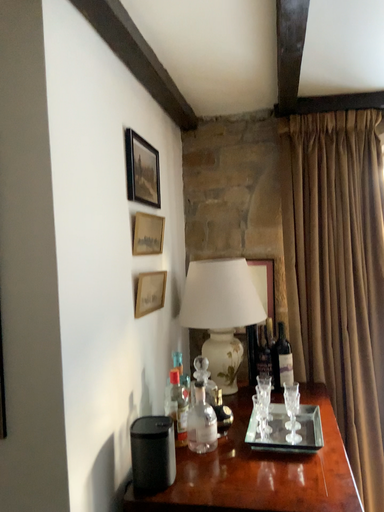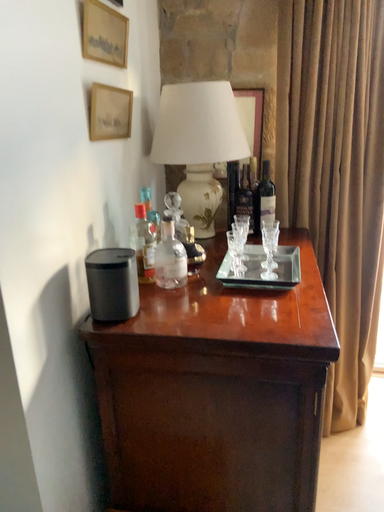
Question: How did the camera likely rotate when shooting the video?

Choices:
 (A) rotated downward
 (B) rotated upward

Answer: (A)